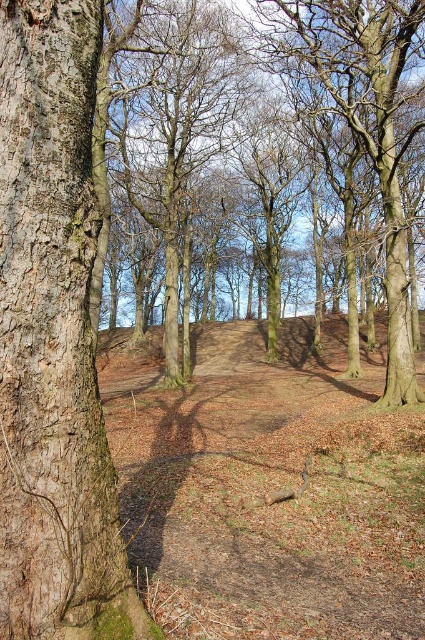
You are hiking in the forest and want to take a photo of the brown rough tree at center and the smooth bark tree at upper center. Which tree should you stand closer to if you want both trees to be in the same frame without moving your camera?

You should stand closer to the smooth bark tree at upper center because the brown rough tree at center is to the left of it, so positioning yourself near the right tree will help keep both in frame.

You are an artist sketching the forest scene. You want to focus on the smooth brown bark at left and the brown rough tree at center. Which one should you draw first if you want to start with the smaller object?

The smooth brown bark at left should be drawn first because it occupies less space than the brown rough tree at center, making it the smaller object.

You are a hiker who wants to take a photo of the brown rough tree at center and the smooth bark tree at upper center. Which tree should you focus on first to ensure both are in the frame?

The brown rough tree at center is positioned under the smooth bark tree at upper center, so you should focus on the smooth bark tree at upper center first to ensure both are in the frame.